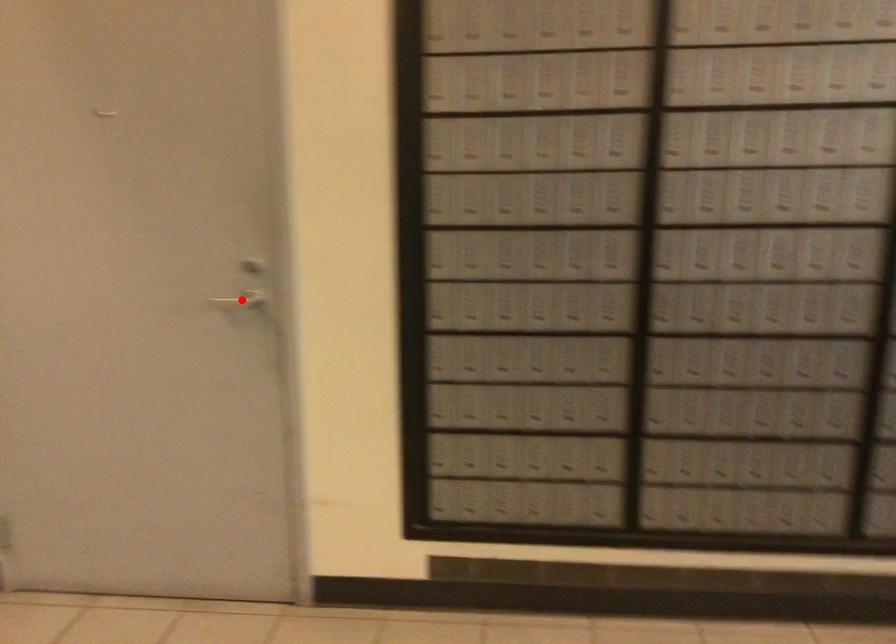
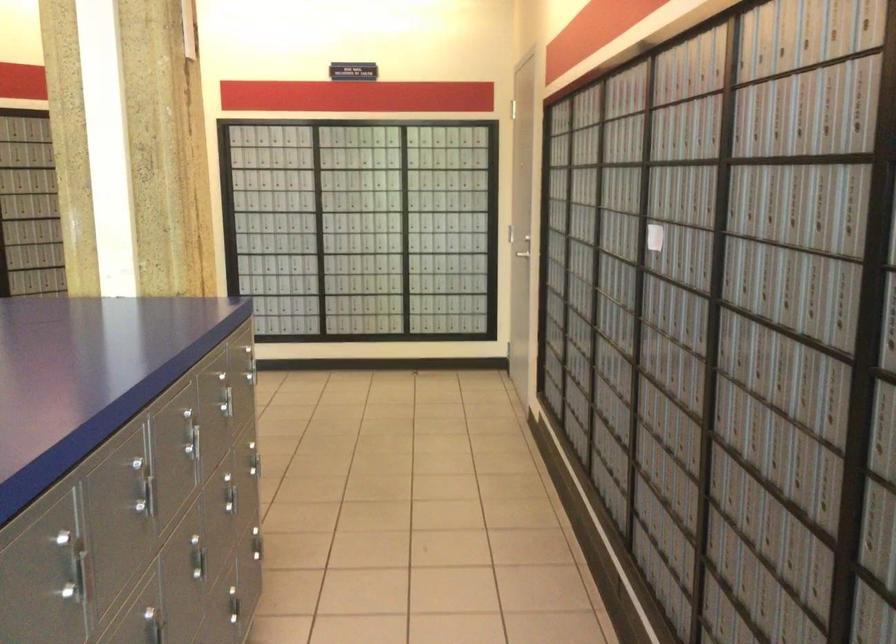
Question: I am providing you with two images of the same scene from different viewpoints. A red point is marked on the first image. Can you still see the location of the red point in image 2?

Choices:
 (A) Yes
 (B) No

Answer: (B)